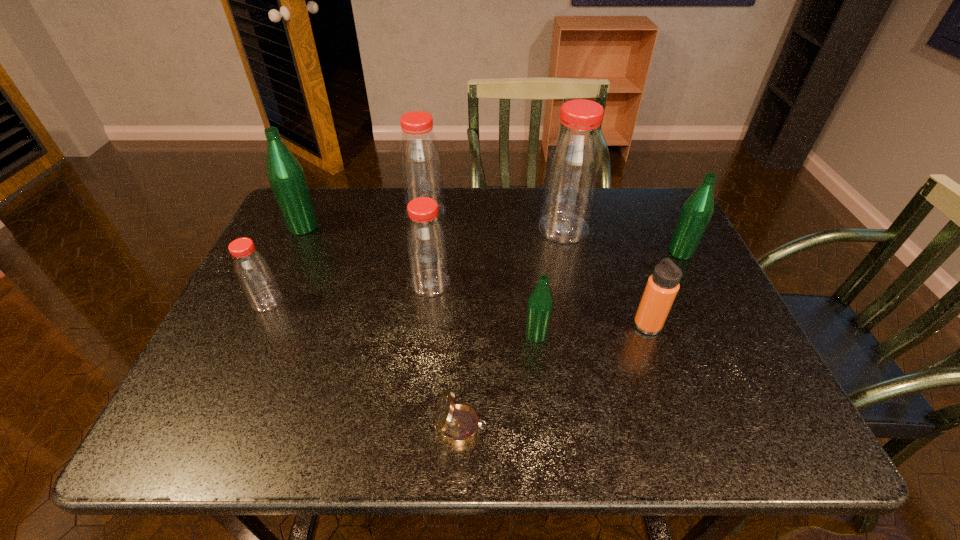
This screenshot has height=540, width=960. I want to click on the smallest red bottle, so click(253, 272).

Find the location of a particular element. The image size is (960, 540). the smallest green bottle is located at coordinates (540, 303).

Locate an element on the screen. the fifth bottle from left to right is located at coordinates (540, 303).

Where is `the shortest object`? the shortest object is located at coordinates (458, 424).

Locate an element on the screen. compass is located at coordinates (458, 424).

This screenshot has height=540, width=960. I want to click on free spot located 0.080m on the left of the tallest bottle, so click(510, 228).

Locate an element on the screen. This screenshot has width=960, height=540. vacant area situated on the back of the second biggest red bottle is located at coordinates (430, 187).

At what (x,y) coordinates should I click in order to perform the action: click on free spot located 0.080m on the front of the leftmost green bottle. Please return your answer as a coordinate pair (x, y). Looking at the image, I should click on (290, 255).

What are the coordinates of `free space located on the left of the second smallest red bottle` in the screenshot? It's located at (265, 284).

Image resolution: width=960 pixels, height=540 pixels. I want to click on free point located 0.240m on the front of the rightmost green bottle, so click(x=720, y=332).